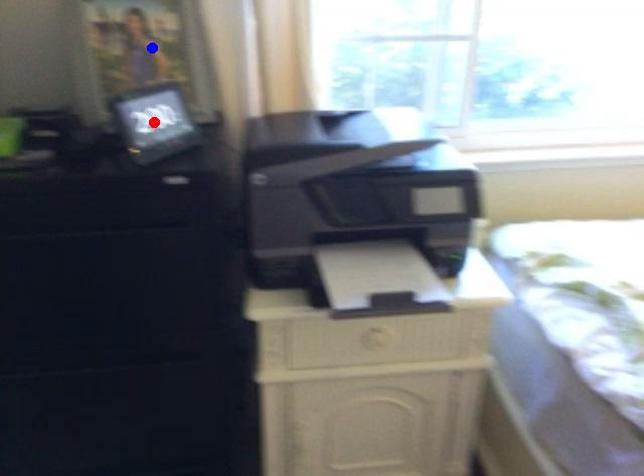
Question: Which of the two points in the image is closer to the camera?

Choices:
 (A) Blue point is closer.
 (B) Red point is closer.

Answer: (B)